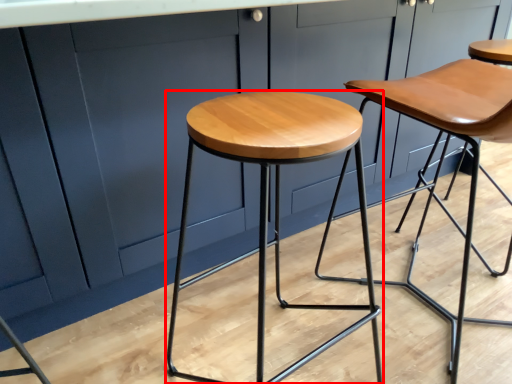
Question: In this image, where is stool (annotated by the red box) located relative to stool?

Choices:
 (A) right
 (B) left

Answer: (B)